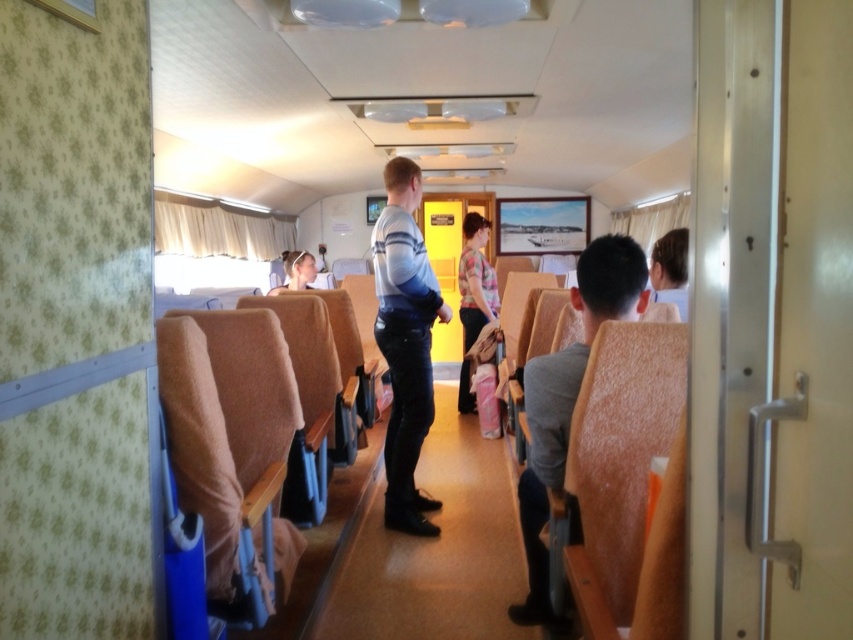
Can you confirm if gray fabric jacket at center is positioned above floral shirt at center?

No.

Is gray fabric jacket at center wider than floral shirt at center?

Yes.

Locate an element on the screen. This screenshot has height=640, width=853. gray fabric jacket at center is located at coordinates (567, 401).

Describe the element at coordinates (405, 342) in the screenshot. I see `matte blue jeans at center` at that location.

Who is taller, matte blue jeans at center or gray fabric jacket at center?

matte blue jeans at center is taller.

Who is more distant from viewer, (393, 424) or (526, 474)?

The point (393, 424) is more distant.

Identify the location of matte blue jeans at center. (405, 342).

At what (x,y) coordinates should I click in order to perform the action: click on brown fabric seat at center. Please return your answer as a coordinate pair (x, y). The height and width of the screenshot is (640, 853). Looking at the image, I should click on (434, 550).

Is brown fabric seat at center wider than floral shirt at center?

Correct, the width of brown fabric seat at center exceeds that of floral shirt at center.

Is point (474, 476) more distant than point (471, 240)?

No, it is not.

Locate an element on the screen. brown fabric seat at center is located at coordinates (434, 550).